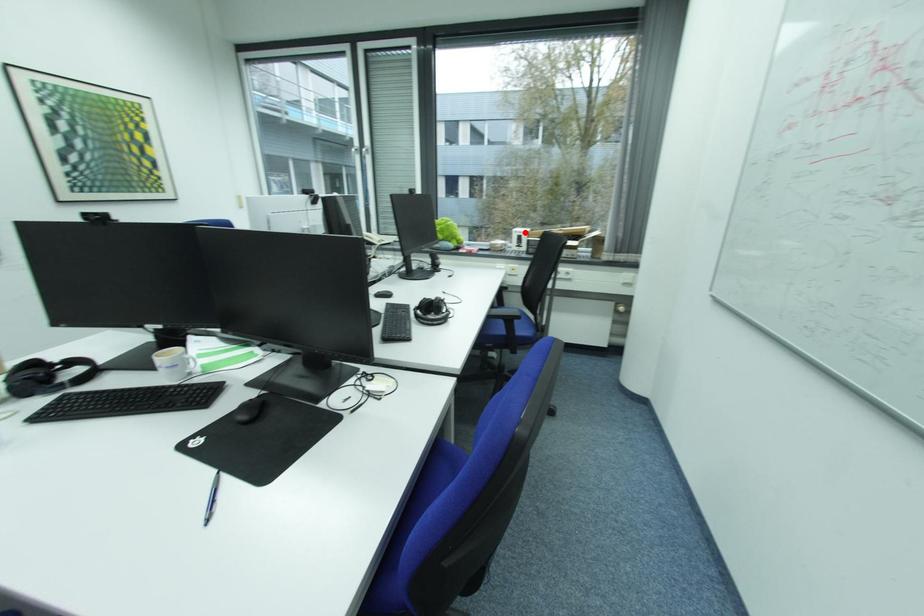
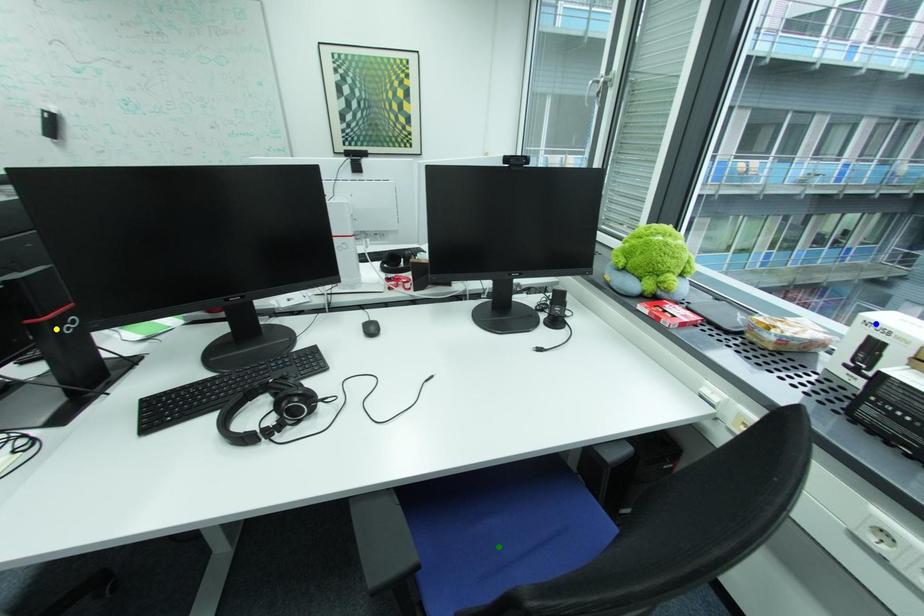
Question: I am providing you with two images of the same scene from different viewpoints. A red point is marked on the first image. You are given multiple points on the second image. Which point in image 2 represents the same 3d spot as the red point in image 1?

Choices:
 (A) blue point
 (B) yellow point
 (C) green point

Answer: (A)